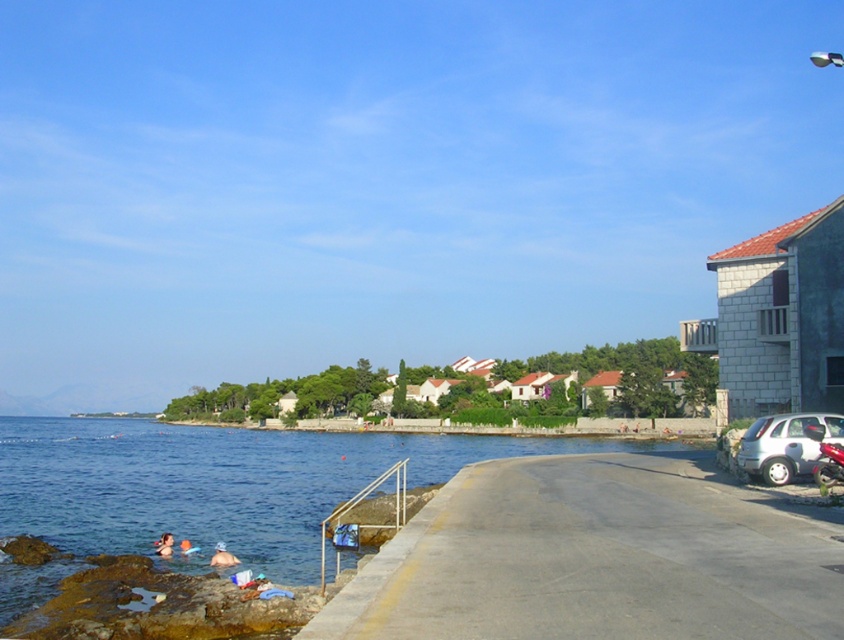
Between concrete at lower left and blue fabric swimmer at lower left, which one is positioned lower?

blue fabric swimmer at lower left

Is point (447, 525) behind point (161, 538)?

No, (447, 525) is closer to viewer.

Locate an element on the screen. concrete at lower left is located at coordinates (598, 557).

Between point (493, 499) and point (836, 432), which one is positioned in front?

Point (493, 499) is in front.

Image resolution: width=844 pixels, height=640 pixels. In order to click on concrete at lower left in this screenshot , I will do `click(598, 557)`.

At what (x,y) coordinates should I click in order to perform the action: click on concrete at lower left. Please return your answer as a coordinate pair (x, y). This screenshot has width=844, height=640. Looking at the image, I should click on (598, 557).

Does white fabric swimmer at lower left appear on the right side of blue fabric swimmer at lower left?

Yes, white fabric swimmer at lower left is to the right of blue fabric swimmer at lower left.

Does white fabric swimmer at lower left have a larger size compared to blue fabric swimmer at lower left?

Yes.

Between point (225, 544) and point (171, 554), which one is positioned behind?

Point (225, 544)

Find the location of a particular element. white fabric swimmer at lower left is located at coordinates (222, 556).